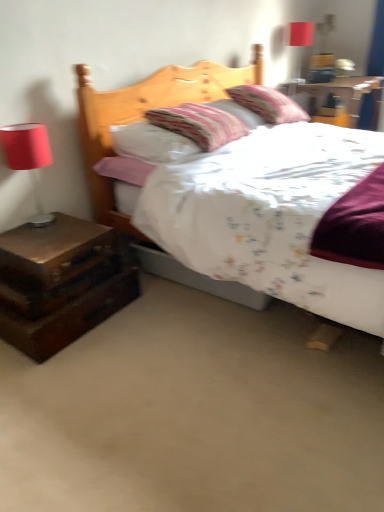
Find the location of a particular element. free space below matte red lampshade at upper right (from a real-world perspective) is located at coordinates (293, 82).